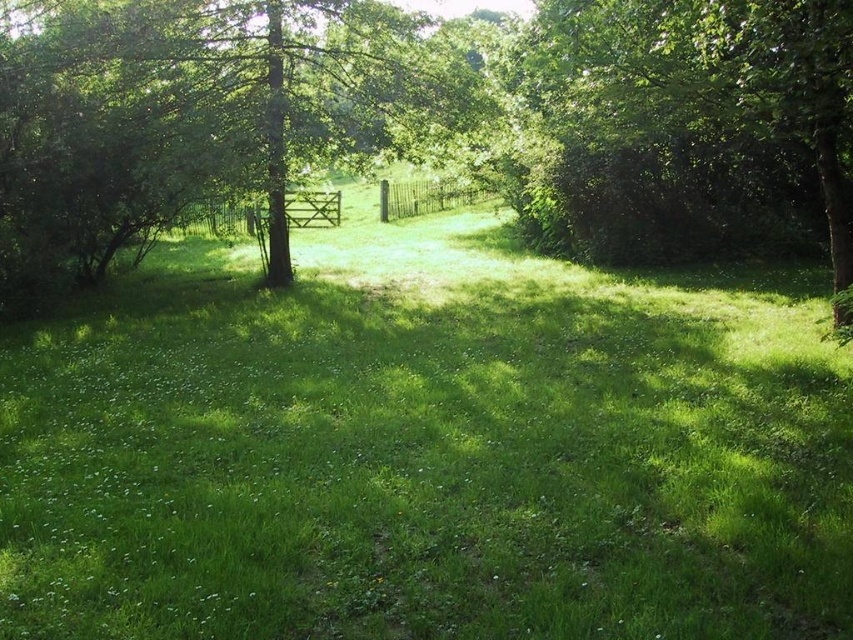
Question: Can you confirm if green grassy at center is positioned to the left of green leafy tree at upper right?

Choices:
 (A) yes
 (B) no

Answer: (A)

Question: Which point appears farthest from the camera in this image?

Choices:
 (A) (62, 332)
 (B) (190, 234)
 (C) (444, 180)
 (D) (839, 250)

Answer: (C)

Question: Where is green grassy at center located in relation to green leafy tree at upper right in the image?

Choices:
 (A) above
 (B) below

Answer: (B)

Question: Which object is the closest to the green leafy tree at center?

Choices:
 (A) green wooden gate at center
 (B) green wooden fence at center

Answer: (A)

Question: Is green leafy tree at center to the right of green leafy tree at upper right from the viewer's perspective?

Choices:
 (A) yes
 (B) no

Answer: (B)

Question: Which point is closer to the camera?

Choices:
 (A) green wooden gate at center
 (B) green leafy tree at center
 (C) green wooden fence at center
 (D) green leafy tree at upper right

Answer: (D)